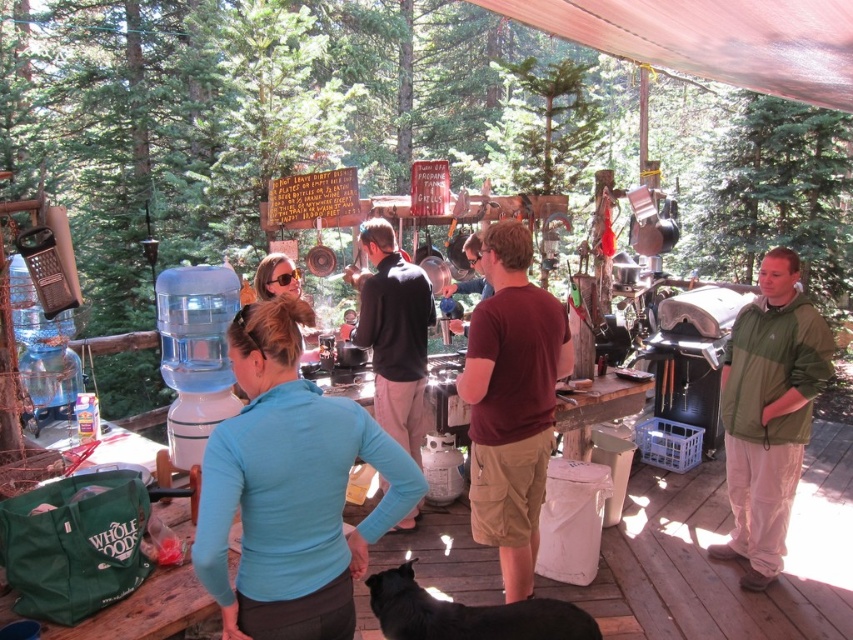
You are standing at point (x=103, y=636) and want to walk to point (x=482, y=435). Which direction should you move?

Since point (x=103, y=636) is in front of point (x=482, y=435), you should move backward to reach your destination.